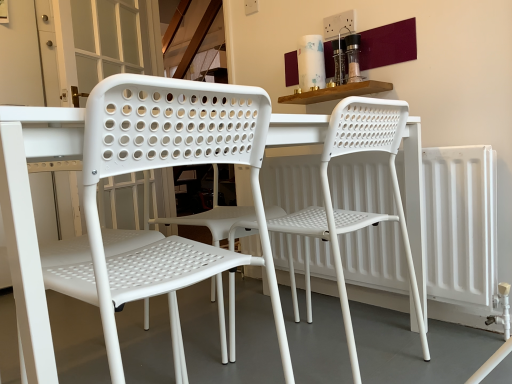
Question: Can white plastic chair at center, marked as the 1th chair in a left-to-right arrangement, be found inside white plastic chair at center, the 1th chair viewed from the right?

Choices:
 (A) no
 (B) yes

Answer: (A)

Question: Considering the relative sizes of white plastic chair at center, the 1th chair viewed from the right, and white plastic chair at center, marked as the 1th chair in a left-to-right arrangement, in the image provided, is white plastic chair at center, the 1th chair viewed from the right, smaller than white plastic chair at center, marked as the 1th chair in a left-to-right arrangement,?

Choices:
 (A) no
 (B) yes

Answer: (A)

Question: Considering the relative sizes of white plastic chair at center, the 1th chair viewed from the right, and white plastic chair at center, marked as the 1th chair in a left-to-right arrangement, in the image provided, is white plastic chair at center, the 1th chair viewed from the right, taller than white plastic chair at center, marked as the 1th chair in a left-to-right arrangement,?

Choices:
 (A) yes
 (B) no

Answer: (A)

Question: Is white plastic chair at center, placed as the 2th chair when sorted from left to right, at the right side of white plastic chair at center, marked as the 1th chair in a left-to-right arrangement?

Choices:
 (A) no
 (B) yes

Answer: (B)

Question: Is white plastic chair at center, placed as the 2th chair when sorted from left to right, positioned in front of white plastic chair at center, marked as the 1th chair in a left-to-right arrangement?

Choices:
 (A) no
 (B) yes

Answer: (A)

Question: Would you say white plastic chair at center, the 1th chair viewed from the right, is to the left or to the right of white matte radiator at right in the picture?

Choices:
 (A) left
 (B) right

Answer: (A)

Question: In terms of size, does white plastic chair at center, placed as the 2th chair when sorted from left to right, appear bigger or smaller than white matte radiator at right?

Choices:
 (A) small
 (B) big

Answer: (B)

Question: Is point (404, 248) positioned closer to the camera than point (401, 269)?

Choices:
 (A) closer
 (B) farther

Answer: (A)

Question: From the image's perspective, is white plastic chair at center, placed as the 2th chair when sorted from left to right, positioned above or below white matte radiator at right?

Choices:
 (A) above
 (B) below

Answer: (A)

Question: From the image's perspective, is white plastic chair at center, placed as the 2th chair when sorted from left to right, located above or below white plastic chair at center, marked as the 1th chair in a left-to-right arrangement?

Choices:
 (A) below
 (B) above

Answer: (B)

Question: Is point (398, 206) closer or farther from the camera than point (203, 132)?

Choices:
 (A) closer
 (B) farther

Answer: (B)

Question: Considering the positions of white plastic chair at center, placed as the 2th chair when sorted from left to right, and white plastic chair at center, marked as the 1th chair in a left-to-right arrangement, in the image, is white plastic chair at center, placed as the 2th chair when sorted from left to right, wider or thinner than white plastic chair at center, marked as the 1th chair in a left-to-right arrangement,?

Choices:
 (A) wide
 (B) thin

Answer: (A)

Question: From a real-world perspective, is white plastic chair at center, the 1th chair viewed from the right, physically located above or below white plastic chair at center, which is the 2th chair from right to left?

Choices:
 (A) above
 (B) below

Answer: (B)

Question: From a real-world perspective, is white plastic chair at center, marked as the 1th chair in a left-to-right arrangement, positioned above or below white matte radiator at right?

Choices:
 (A) below
 (B) above

Answer: (B)

Question: Is white plastic chair at center, which is the 2th chair from right to left, in front of or behind white matte radiator at right in the image?

Choices:
 (A) behind
 (B) front

Answer: (B)